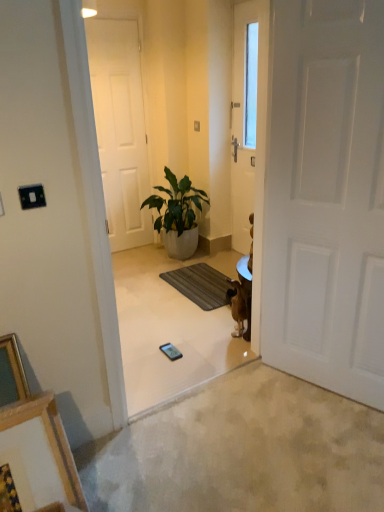
Where is `free space in front of brown fur dog at center-right`? free space in front of brown fur dog at center-right is located at coordinates (229, 355).